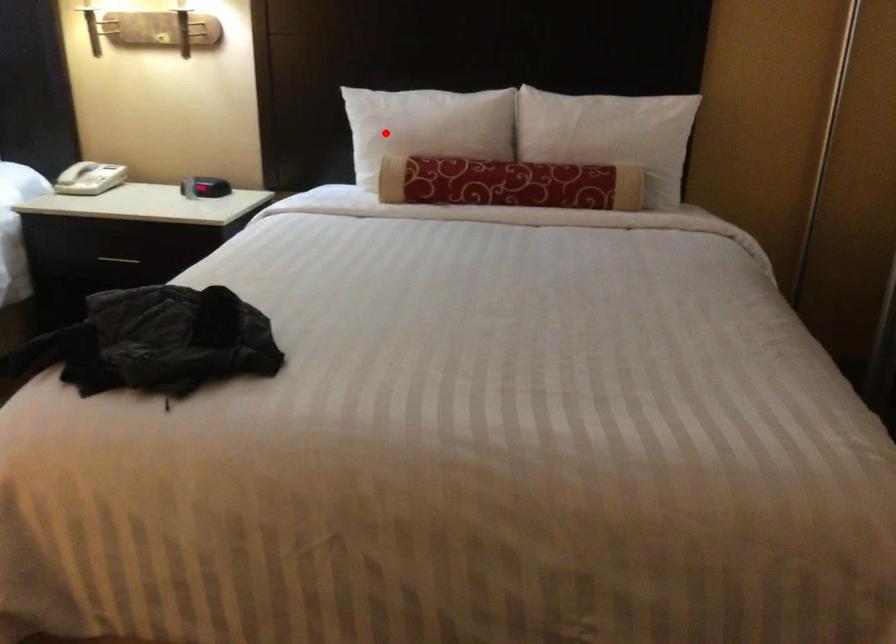
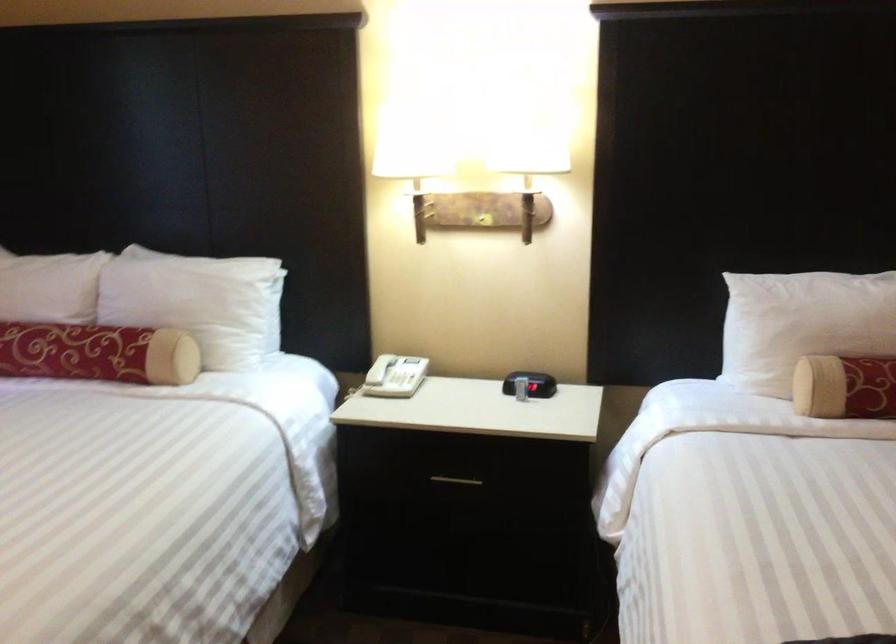
In the second image, find the point that corresponds to the highlighted location in the first image.

(802, 324)